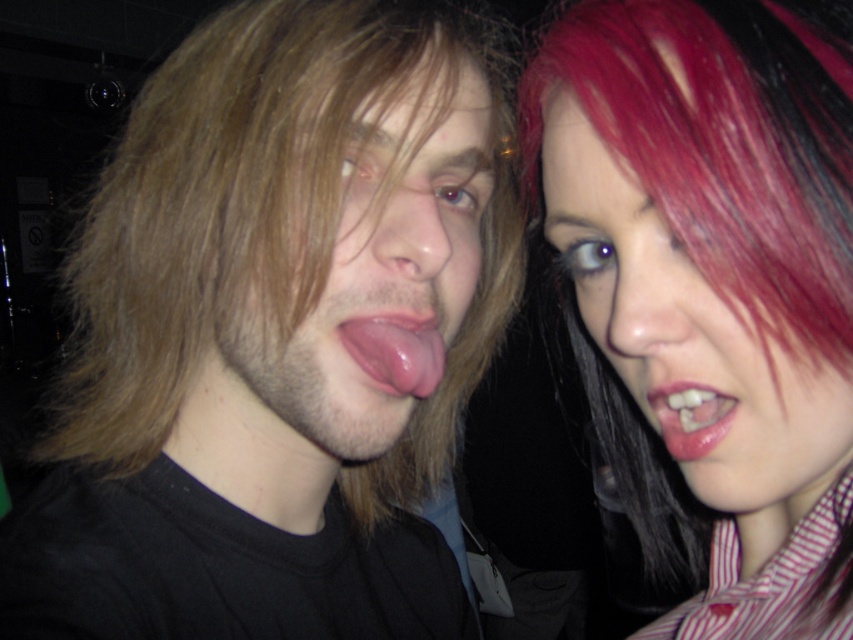
You are a photographer adjusting lighting for a portrait. You notice the matte black shirt at left and the pink flesh tongue at center. Which object should you focus on to ensure proper exposure if the tongue requires more light?

The pink flesh tongue at center requires more light, so you should focus on it to ensure proper exposure since it is narrower than the matte black shirt at left.

You are a photographer trying to focus your camera on the shiny pink hair at upper right and the glossy pink lips at upper right. Which object should you adjust your focus to first if you want to capture both in the same frame?

The shiny pink hair at upper right has a greater height compared to glossy pink lips at upper right, so you should focus on the shiny pink hair at upper right first to ensure it is in frame before adjusting for the glossy pink lips at upper right.

In the scene shown: You are a photographer adjusting the focus on your camera. You want to ensure both the matte skin face at center and the glossy pink lips at upper right are in focus. Given their sizes, which object should you prioritize focusing on first?

The matte skin face at center has a greater height compared to glossy pink lips at upper right, so you should prioritize focusing on the matte skin face at center first because it is larger and requires more precise focus to capture details.